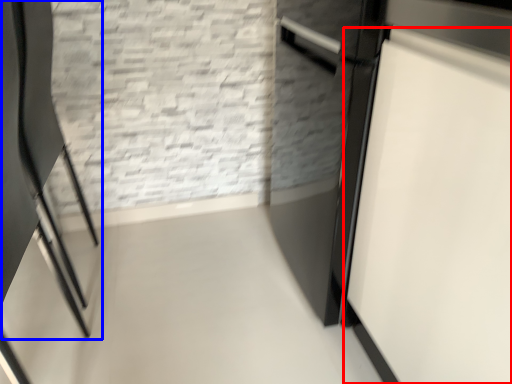
Question: Which object appears closest to the camera in this image, door (highlighted by a red box) or chair (highlighted by a blue box)?

Choices:
 (A) door
 (B) chair

Answer: (A)